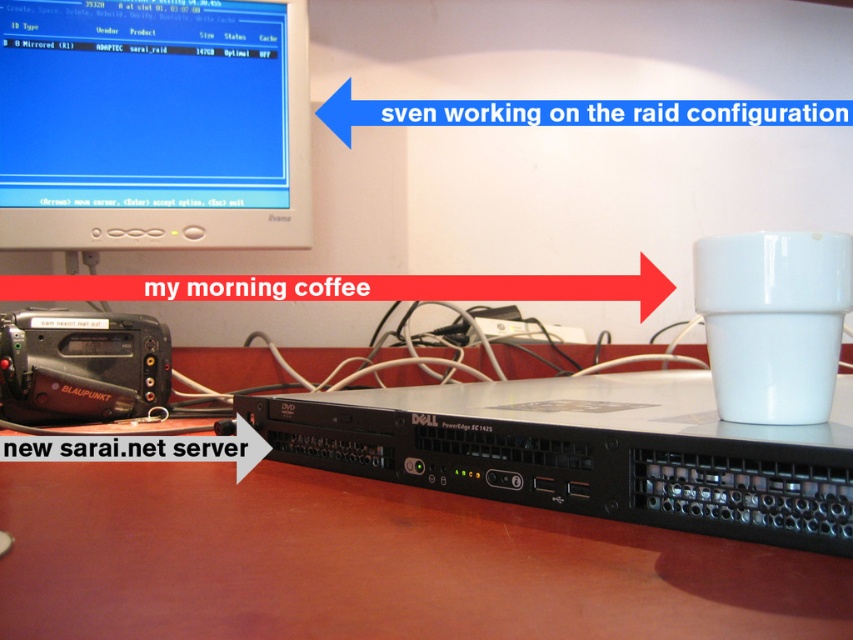
You are a barista preparing a customer order. You have a white glossy mug at right and a brown wooden table at center. Can you place the mug on the table without moving anything else?

The distance between the brown wooden table at center and the white glossy mug at right is 9.11 inches, so yes, the mug can be placed on the table as the distance is sufficient.

You are organizing items on a desk and need to place a new item between the brown wooden table at center and the white glossy mug at right. Based on their positions, which object should the new item be closer to?

The new item should be placed closer to the white glossy mug at right because the brown wooden table at center is in front of it, meaning the mug is farther back. Placing the new item between them would require positioning it nearer to the mug to maintain spatial order.

You are setting up a new coffee station in your office. You have a brown wooden table at center and a white glossy mug at right. Which object is shorter?

The brown wooden table at center is not as tall as the white glossy mug at right, so the brown wooden table at center is shorter.